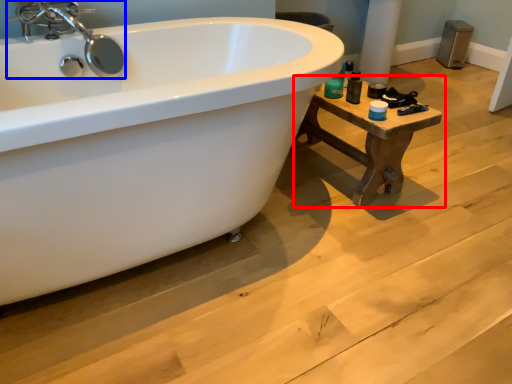
Question: Which object appears closest to the camera in this image, table (highlighted by a red box) or tap (highlighted by a blue box)?

Choices:
 (A) table
 (B) tap

Answer: (B)